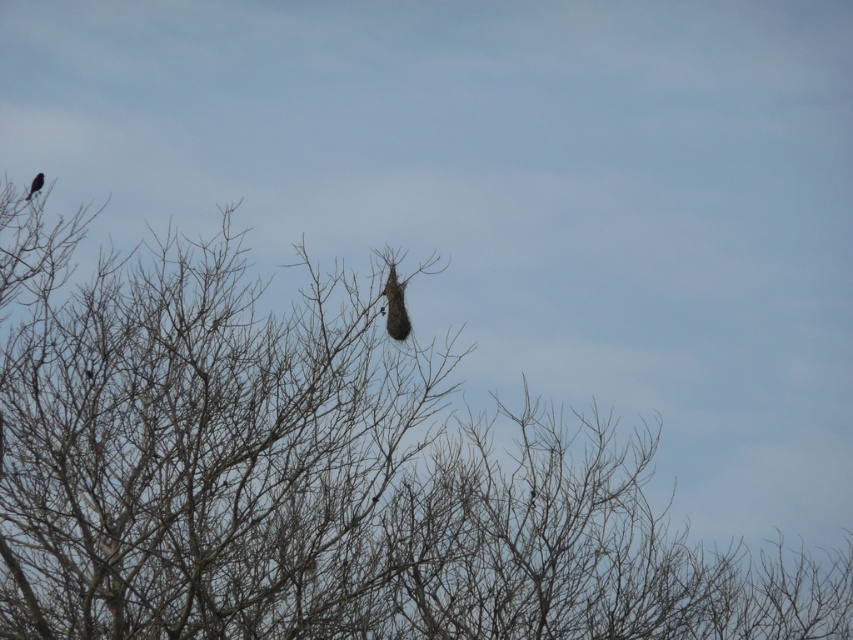
Question: Which of the following is the closest to the observer?

Choices:
 (A) dark brown feathered bird at center
 (B) silhouette glossy bird at upper left
 (C) brown textured nest at center

Answer: (C)

Question: Where is brown textured nest at center located in relation to dark brown feathered bird at center in the image?

Choices:
 (A) above
 (B) below

Answer: (B)

Question: Does brown textured nest at center have a smaller size compared to dark brown feathered bird at center?

Choices:
 (A) no
 (B) yes

Answer: (A)

Question: Which of the following is the closest to the observer?

Choices:
 (A) (61, 304)
 (B) (397, 332)
 (C) (32, 184)

Answer: (B)

Question: Is brown textured nest at center to the right of silhouette glossy bird at upper left from the viewer's perspective?

Choices:
 (A) yes
 (B) no

Answer: (A)

Question: Which of these objects is positioned farthest from the dark brown feathered bird at center?

Choices:
 (A) silhouette glossy bird at upper left
 (B) brown textured nest at center

Answer: (A)